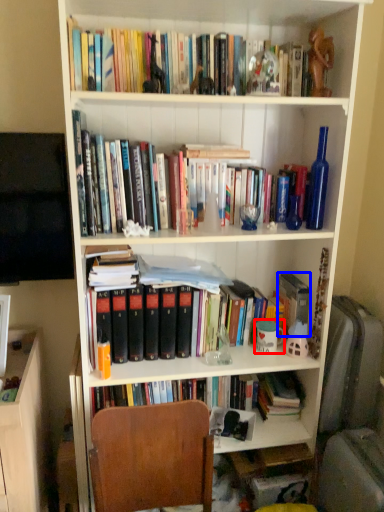
Question: Which of the following is the closest to the observer, coffee cup (highlighted by a red box) or paperback book (highlighted by a blue box)?

Choices:
 (A) coffee cup
 (B) paperback book

Answer: (A)